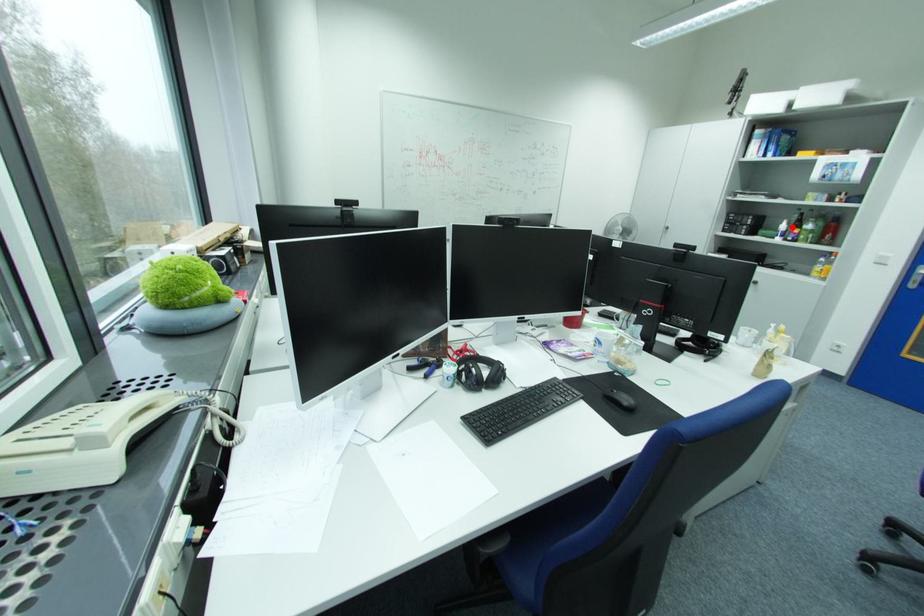
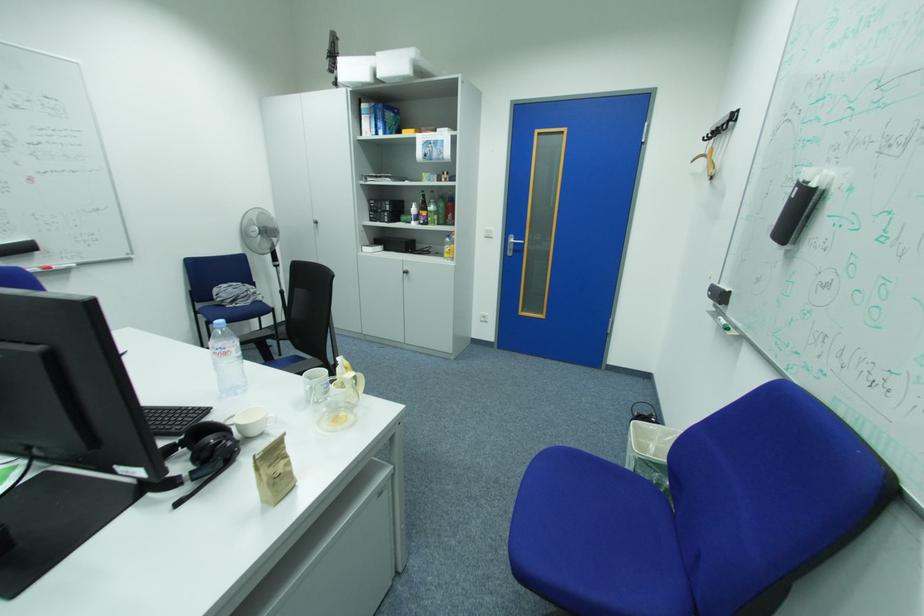
Question: I am providing you with two images of the same scene from different viewpoints. Image1 has a red point marked. In image2, the corresponding 3D location appears at what relative position? Reply with the corresponding letter.

Choices:
 (A) Closer
 (B) Farther

Answer: (A)